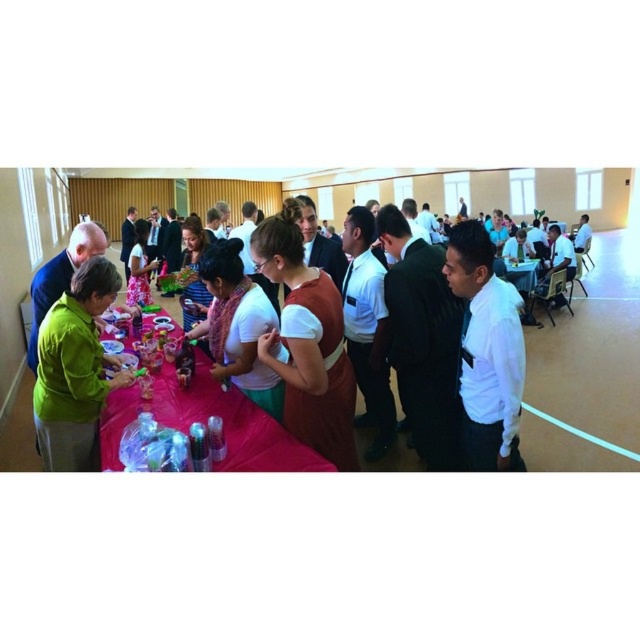
Which of these two, white shirt at center or white matte shirt at center, stands taller?

Standing taller between the two is white shirt at center.

Is white shirt at center positioned in front of white matte shirt at center?

Yes, it is in front of white matte shirt at center.

From the picture: Who is more forward, (x=460, y=378) or (x=259, y=304)?

Point (x=460, y=378) is in front.

Identify the location of white shirt at center. (486, 353).

Can you confirm if green matte jacket at left is positioned to the right of white shirt at right?

Incorrect, green matte jacket at left is not on the right side of white shirt at right.

The width and height of the screenshot is (640, 640). Describe the element at coordinates (60, 276) in the screenshot. I see `green matte jacket at left` at that location.

The height and width of the screenshot is (640, 640). I want to click on green matte jacket at left, so click(60, 276).

Does green fabric tablecloth at left have a smaller size compared to green matte jacket at left?

Actually, green fabric tablecloth at left might be larger than green matte jacket at left.

Does green fabric tablecloth at left appear on the left side of green matte jacket at left?

In fact, green fabric tablecloth at left is to the right of green matte jacket at left.

Image resolution: width=640 pixels, height=640 pixels. What do you see at coordinates (289, 376) in the screenshot?
I see `green fabric tablecloth at left` at bounding box center [289, 376].

This screenshot has height=640, width=640. In order to click on green fabric tablecloth at left in this screenshot , I will do `click(289, 376)`.